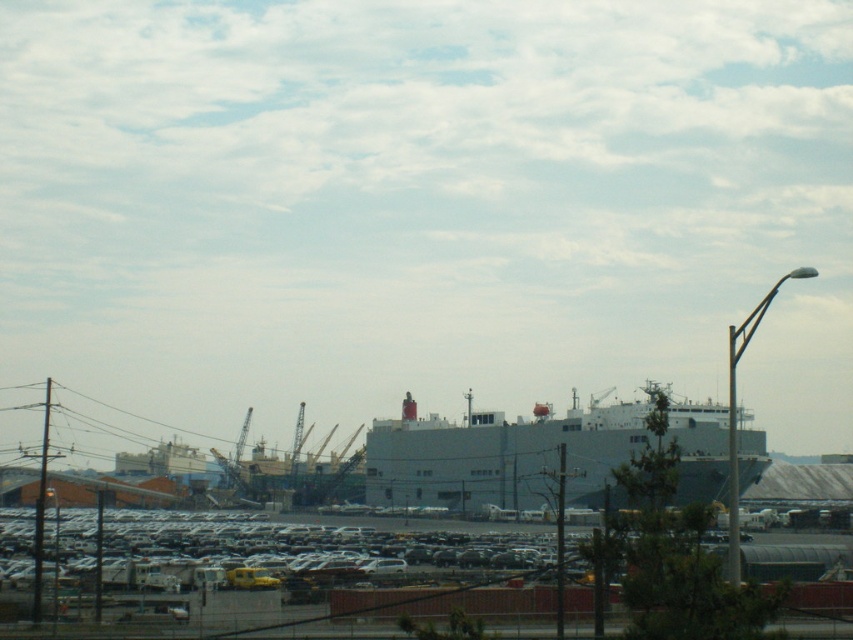
Which is behind, point (457, 554) or point (421, 435)?

Point (421, 435)

Is white matte parking lot at lower center in front of gray matte ship at center?

Yes, white matte parking lot at lower center is closer to the viewer.

You are a GUI agent. You are given a task and a screenshot of the screen. Output one action in this format:
    pyautogui.click(x=<x>, y=<y>)
    Task: Click on the white matte parking lot at lower center
    
    Given the screenshot: What is the action you would take?
    pyautogui.click(x=285, y=573)